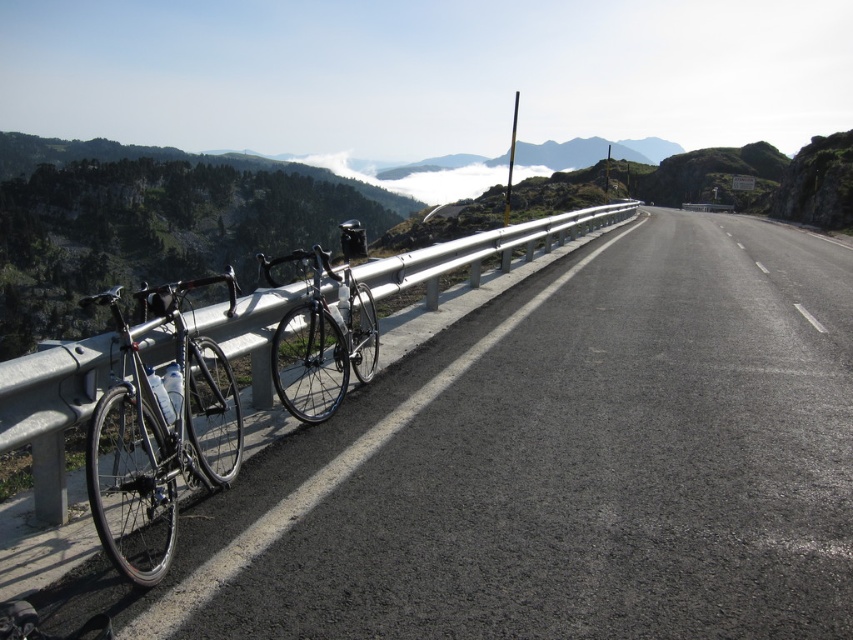
You are a cyclist who wants to secure your shiny silver bicycle at left to the silver metallic rail at left. Based on the scene, can you determine if the bicycle is bigger than the rail?

The shiny silver bicycle at left has a larger size compared to the silver metallic rail at left, so yes, the bicycle is bigger than the rail.

You are a delivery person who needs to choose between the shiny silver bicycle at left and the shiny black bicycle at center to deliver packages. Which bicycle is larger and better suited for carrying heavy loads?

The shiny black bicycle at center is larger than the shiny silver bicycle at left, making it better suited for carrying heavy loads.